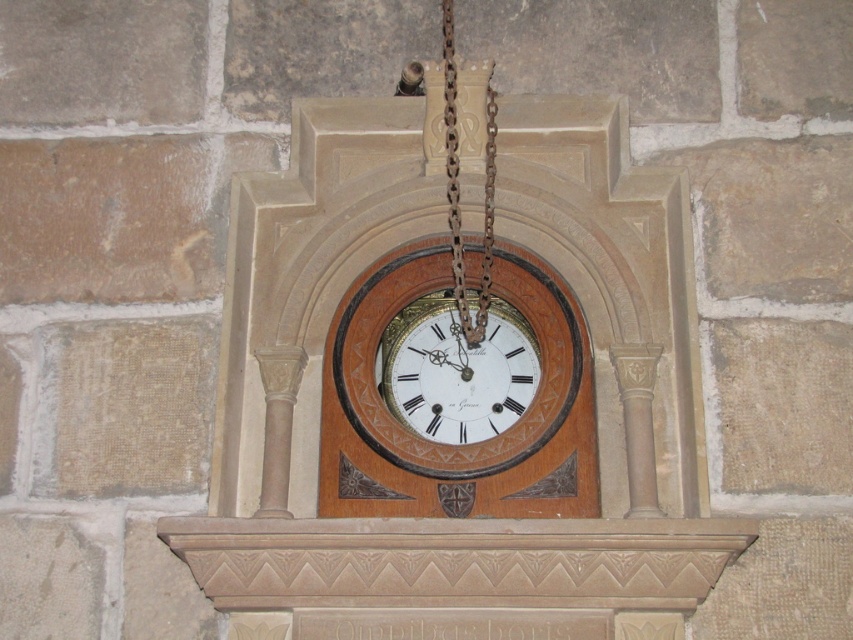
Question: Which of the following is the closest to the observer?

Choices:
 (A) wooden clock at center
 (B) rusty metal chain at center

Answer: (B)

Question: Which point is farther to the camera?

Choices:
 (A) gold metallic clock at center
 (B) wooden clock at center
 (C) rusty metal chain at center

Answer: (A)

Question: Where is wooden clock at center located in relation to rusty metal chain at center in the image?

Choices:
 (A) left
 (B) right

Answer: (A)

Question: Does wooden clock at center appear on the right side of rusty metal chain at center?

Choices:
 (A) yes
 (B) no

Answer: (B)

Question: Does gold metallic clock at center come behind wooden clock at center?

Choices:
 (A) no
 (B) yes

Answer: (B)

Question: Which point is closer to the camera?

Choices:
 (A) (486, 177)
 (B) (428, 380)

Answer: (B)